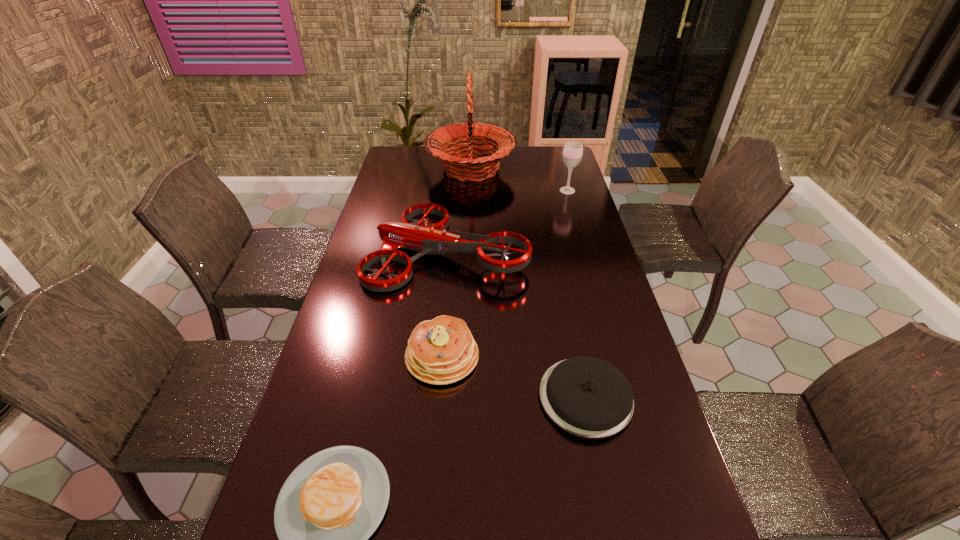
Locate an element on the screen. This screenshot has width=960, height=540. vacant area that lies between the fifth shortest object and the basket is located at coordinates (519, 180).

Where is `free area in between the basket and the drone`? This screenshot has height=540, width=960. free area in between the basket and the drone is located at coordinates pos(459,208).

This screenshot has height=540, width=960. Find the location of `free space that is in between the fifth shortest object and the tallest object`. free space that is in between the fifth shortest object and the tallest object is located at coordinates (519, 180).

Find the location of `free spot between the tallest pancake and the wineglass`. free spot between the tallest pancake and the wineglass is located at coordinates (505, 274).

Identify the location of vacant area that lies between the wineglass and the drone. The width and height of the screenshot is (960, 540). (508, 219).

You are a GUI agent. You are given a task and a screenshot of the screen. Output one action in this format:
    pyautogui.click(x=<x>, y=<y>)
    Task: Click on the empty space between the rightmost pancake and the tallest object
    This screenshot has height=540, width=960.
    Given the screenshot: What is the action you would take?
    pyautogui.click(x=528, y=283)

Locate an element on the screen. empty location between the tallest pancake and the tallest object is located at coordinates (457, 263).

Find the location of a particular element. the third closest object to the shortest pancake is located at coordinates (434, 239).

Identify which object is the fifth nearest to the drone. Please provide its 2D coordinates. Your answer should be formatted as a tuple, i.e. [(x, y)], where the tuple contains the x and y coordinates of a point satisfying the conditions above.

[(331, 504)]

Where is `pancake that is the second closest to the tallest pancake`? The height and width of the screenshot is (540, 960). pancake that is the second closest to the tallest pancake is located at coordinates (331, 504).